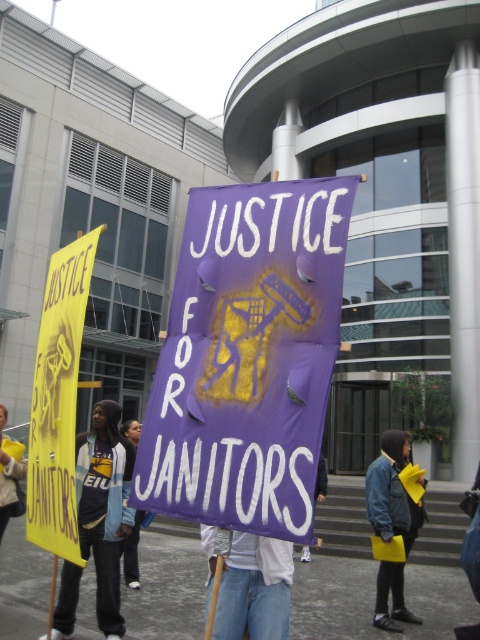
You are standing in front of the modern building and want to take a photo of the two points. Which point, point (121, 480) or point (6, 449), will appear larger in your camera view?

Point (121, 480) is closer to the camera than point (6, 449), so it will appear larger in the camera view.